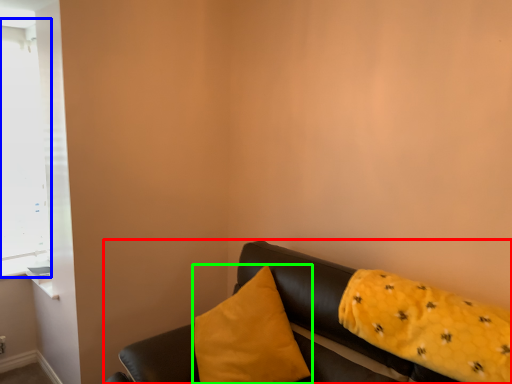
Question: Estimate the real-world distances between objects in this image. Which object is farther from studio couch (highlighted by a red box), window (highlighted by a blue box) or pillow (highlighted by a green box)?

Choices:
 (A) window
 (B) pillow

Answer: (A)